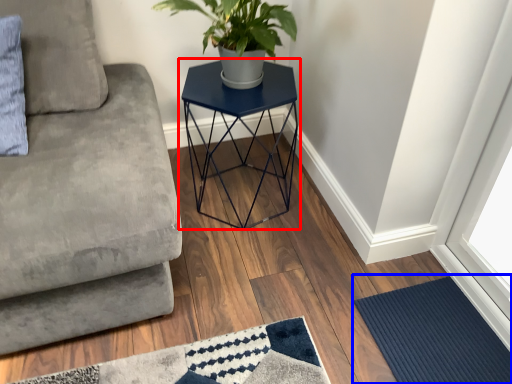
Question: Which object is closer to the camera taking this photo, table (highlighted by a red box) or doormat (highlighted by a blue box)?

Choices:
 (A) table
 (B) doormat

Answer: (B)